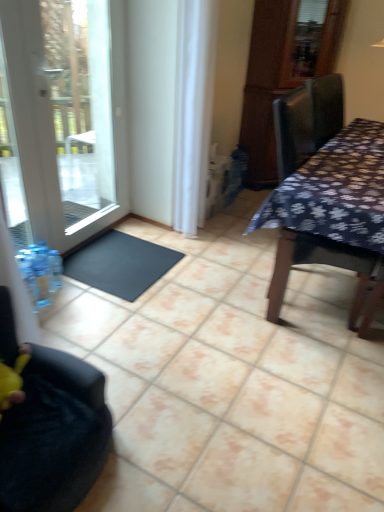
Where is `free space between white sheer curtain at center and dark floral fabric table at right`? The height and width of the screenshot is (512, 384). free space between white sheer curtain at center and dark floral fabric table at right is located at coordinates (231, 254).